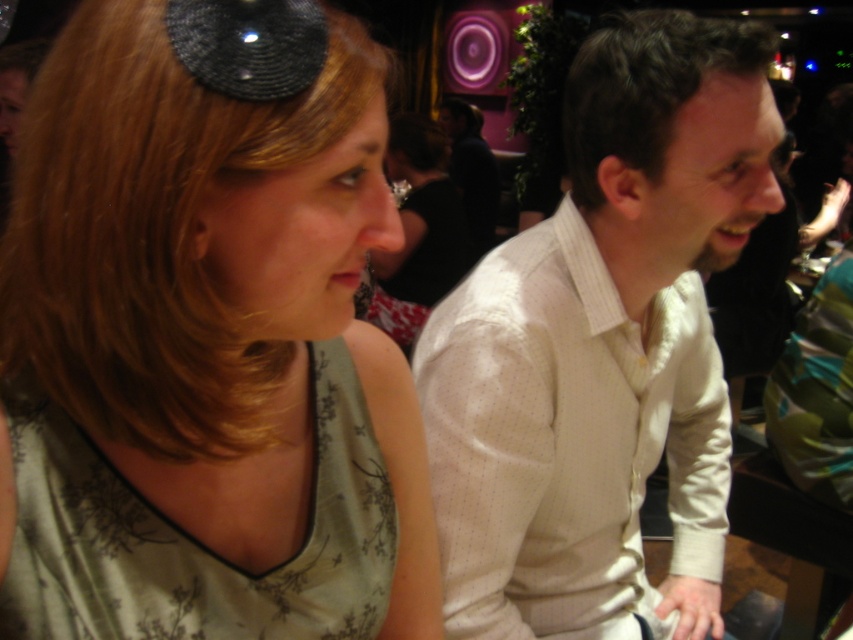
In the scene shown: Can you confirm if green floral fabric at center is shorter than white textured shirt at right?

Indeed, green floral fabric at center has a lesser height compared to white textured shirt at right.

Between green floral fabric at center and white textured shirt at right, which one is positioned lower?

Positioned lower is green floral fabric at center.

Between point (231, 468) and point (421, 337), which one is positioned behind?

The point (421, 337) is behind.

Find the location of `green floral fabric at center`. green floral fabric at center is located at coordinates (206, 337).

Does green floral fabric at center have a greater height compared to matte black hair at center?

Incorrect, green floral fabric at center's height is not larger of matte black hair at center's.

Who is taller, green floral fabric at center or matte black hair at center?

matte black hair at center is taller.

The height and width of the screenshot is (640, 853). I want to click on green floral fabric at center, so click(x=206, y=337).

Is point (598, 209) closer to viewer compared to point (424, 198)?

Yes, it is.

Is point (740, 161) behind point (460, 218)?

No.

Who is more distant from viewer, (552,579) or (445,154)?

The point (445,154) is behind.

You are a GUI agent. You are given a task and a screenshot of the screen. Output one action in this format:
    pyautogui.click(x=<x>, y=<y>)
    Task: Click on the white textured shirt at right
    
    Given the screenshot: What is the action you would take?
    pyautogui.click(x=602, y=346)